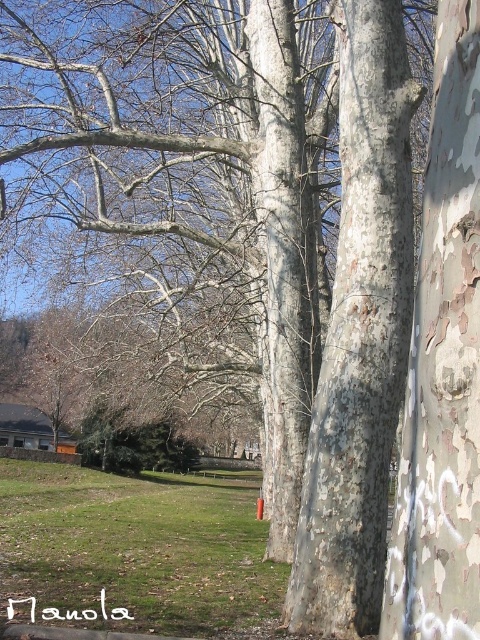
Question: Can you confirm if white textured bark at center is wider than green grass at lower left?

Choices:
 (A) yes
 (B) no

Answer: (B)

Question: Can you confirm if white textured bark at center is positioned below green grass at lower left?

Choices:
 (A) yes
 (B) no

Answer: (B)

Question: Among these points, which one is farthest from the camera?

Choices:
 (A) (233, 602)
 (B) (421, 440)

Answer: (A)

Question: Observing the image, what is the correct spatial positioning of white textured bark at center in reference to green grass at lower left?

Choices:
 (A) right
 (B) left

Answer: (A)

Question: Which object is closer to the camera taking this photo?

Choices:
 (A) green grass at lower left
 (B) white textured bark at center

Answer: (B)

Question: Which point appears closest to the camera in this image?

Choices:
 (A) (467, 330)
 (B) (200, 493)

Answer: (A)